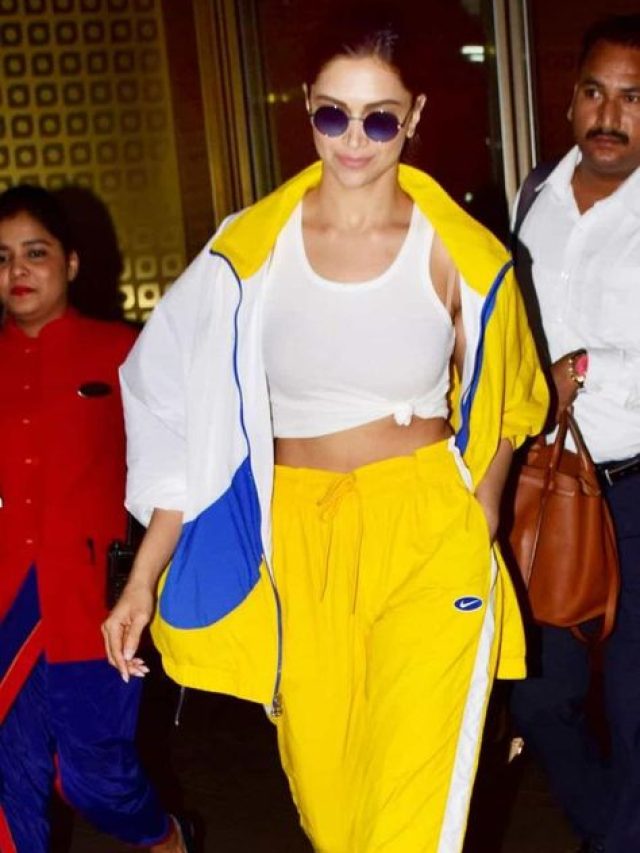
I want to click on doorway, so (456, 102).